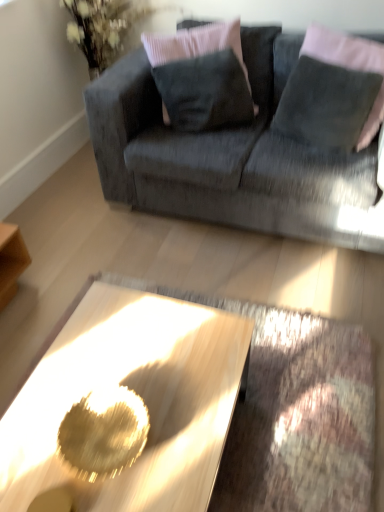
Question: Would you say velvet gray couch at upper center is to the left or to the right of velvet dark gray pillow at upper center, which is counted as the 2th pillow, starting from the right, in the picture?

Choices:
 (A) right
 (B) left

Answer: (A)

Question: In terms of size, does velvet gray couch at upper center appear bigger or smaller than velvet dark gray pillow at upper center, which is the 1th pillow in left-to-right order?

Choices:
 (A) small
 (B) big

Answer: (B)

Question: Which object is positioned farthest from the velvet gray couch at upper center?

Choices:
 (A) metallic gold coffee table at center
 (B) velvet gray pillow at upper right, which is the second pillow in left-to-right order
 (C) velvet dark gray pillow at upper center, which is counted as the 2th pillow, starting from the right

Answer: (A)

Question: Considering the real-world distances, which object is farthest from the velvet gray couch at upper center?

Choices:
 (A) velvet dark gray pillow at upper center, which is counted as the 2th pillow, starting from the right
 (B) velvet gray pillow at upper right, which is the second pillow in left-to-right order
 (C) metallic gold coffee table at center

Answer: (C)